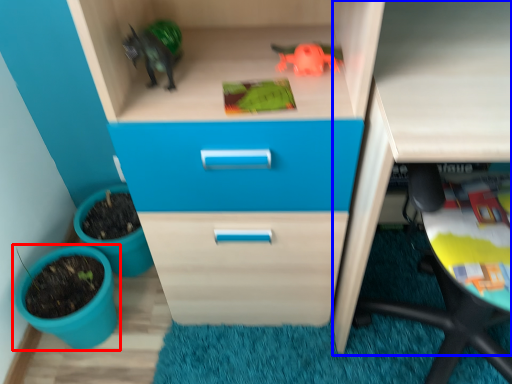
Question: Which of the following is the farthest to the observer, flowerpot (highlighted by a red box) or computer desk (highlighted by a blue box)?

Choices:
 (A) flowerpot
 (B) computer desk

Answer: (A)